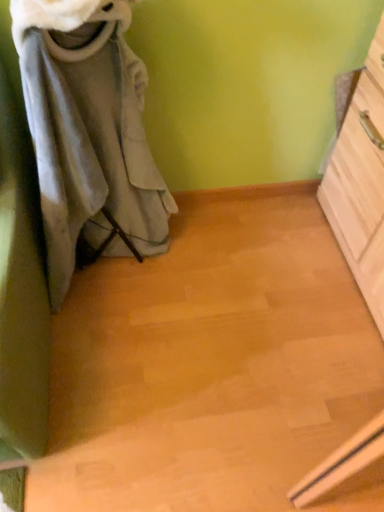
Question: From a real-world perspective, is light wood chest of drawers at right above or below gray fabric laundry at left?

Choices:
 (A) above
 (B) below

Answer: (B)

Question: Is light wood chest of drawers at right inside or outside of gray fabric laundry at left?

Choices:
 (A) outside
 (B) inside

Answer: (A)

Question: Considering the positions of light wood chest of drawers at right and gray fabric laundry at left in the image, is light wood chest of drawers at right wider or thinner than gray fabric laundry at left?

Choices:
 (A) wide
 (B) thin

Answer: (B)

Question: Is point (150, 166) closer or farther from the camera than point (336, 217)?

Choices:
 (A) farther
 (B) closer

Answer: (B)

Question: Is gray fabric laundry at left inside the boundaries of light wood chest of drawers at right, or outside?

Choices:
 (A) outside
 (B) inside

Answer: (A)

Question: In the image, is gray fabric laundry at left positioned in front of or behind light wood chest of drawers at right?

Choices:
 (A) behind
 (B) front

Answer: (B)

Question: Considering the relative positions of gray fabric laundry at left and light wood chest of drawers at right in the image provided, is gray fabric laundry at left to the left or to the right of light wood chest of drawers at right?

Choices:
 (A) left
 (B) right

Answer: (A)